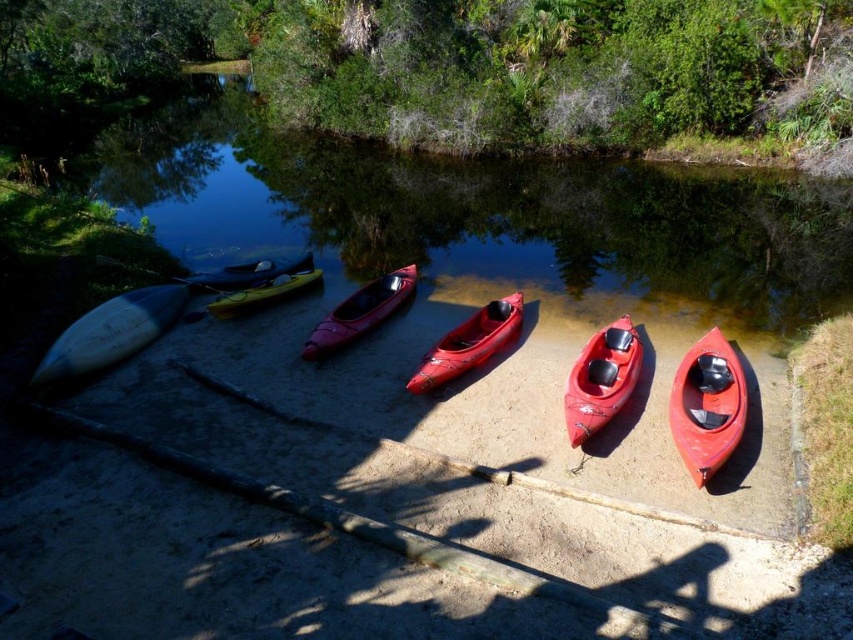
At what (x,y) coordinates should I click in order to perform the action: click on white matte canoe at left. Please return your answer as a coordinate pair (x, y). Looking at the image, I should click on (109, 332).

Does point (136, 326) come farther from viewer compared to point (445, 346)?

Yes, point (136, 326) is behind point (445, 346).

You are a GUI agent. You are given a task and a screenshot of the screen. Output one action in this format:
    pyautogui.click(x=<x>, y=<y>)
    Task: Click on the white matte canoe at left
    The height and width of the screenshot is (640, 853).
    Given the screenshot: What is the action you would take?
    pyautogui.click(x=109, y=332)

Between point (256, 292) and point (183, 284), which one is positioned in front?

Positioned in front is point (256, 292).

Between yellow matte kayak at left and white plastic paddle at left, which one appears on the right side from the viewer's perspective?

Positioned to the right is yellow matte kayak at left.

Is point (248, 289) in front of point (225, 291)?

Yes, it is in front of point (225, 291).

Find the location of a particular element. The width and height of the screenshot is (853, 640). yellow matte kayak at left is located at coordinates (264, 292).

Between smooth water at center and yellow matte kayak at left, which one has less height?

With less height is yellow matte kayak at left.

Measure the distance between smooth water at center and camera.

They are 12.16 meters apart.

You are a GUI agent. You are given a task and a screenshot of the screen. Output one action in this format:
    pyautogui.click(x=<x>, y=<y>)
    Task: Click on the smooth water at center
    
    Given the screenshot: What is the action you would take?
    pyautogui.click(x=479, y=214)

Identify the location of smooth water at center. The height and width of the screenshot is (640, 853). (479, 214).